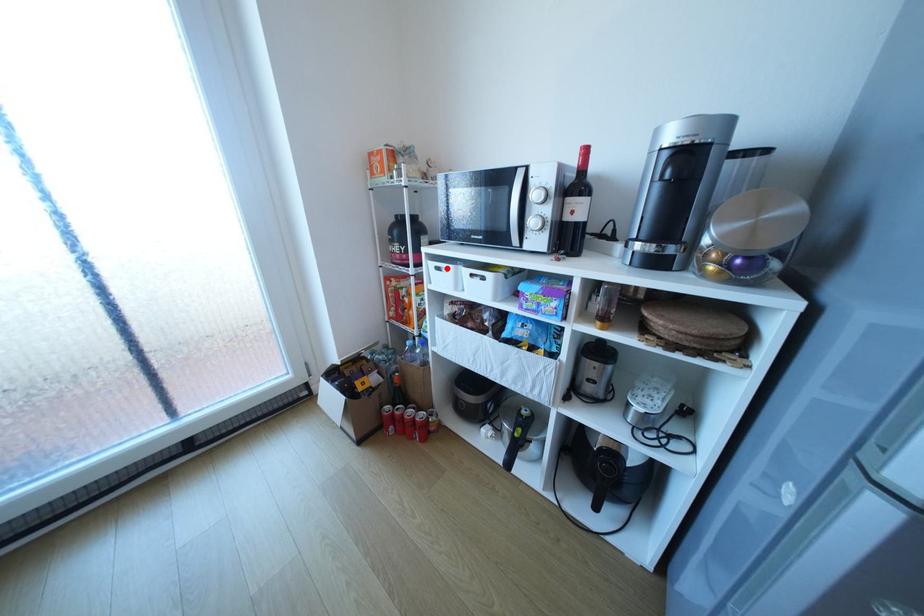
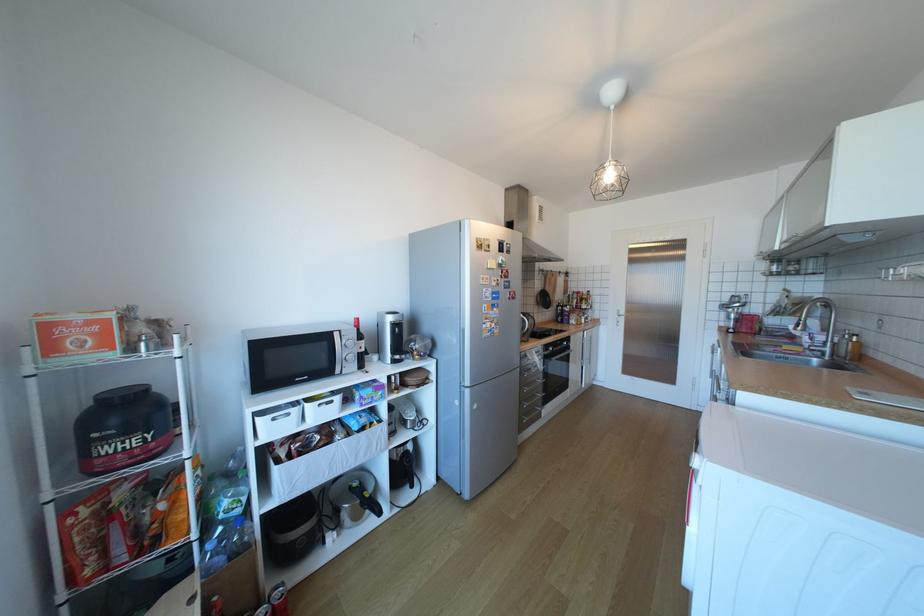
The point at the highlighted location is marked in the first image. Where is the corresponding point in the second image?

(283, 419)